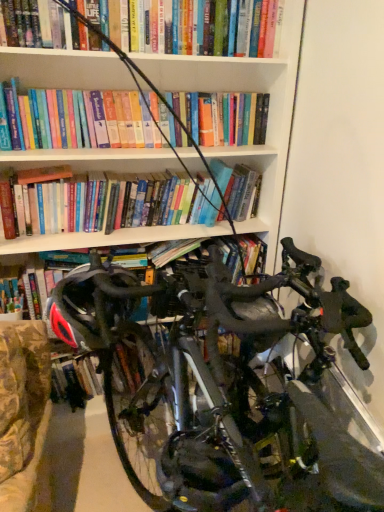
Measure the distance between shiny black bicycle at center and camera.

shiny black bicycle at center and camera are 22.71 inches apart.

I want to click on shiny black bicycle at center, so click(x=223, y=386).

What do you see at coordinates (223, 386) in the screenshot? I see `shiny black bicycle at center` at bounding box center [223, 386].

The height and width of the screenshot is (512, 384). Describe the element at coordinates (82, 306) in the screenshot. I see `black matte helmet at center` at that location.

I want to click on black matte helmet at center, so 82,306.

Locate an element on the screen. shiny black bicycle at center is located at coordinates (223, 386).

Is black matte helmet at center at the right side of shiny black bicycle at center?

No.

Is the depth of black matte helmet at center greater than that of shiny black bicycle at center?

Yes.

Which is nearer, (83,322) or (275,417)?

The point (275,417) is closer.

From the image's perspective, which is below, black matte helmet at center or shiny black bicycle at center?

From the image's view, shiny black bicycle at center is below.

From a real-world perspective, is black matte helmet at center physically located above or below shiny black bicycle at center?

From a real-world perspective, black matte helmet at center is physically above shiny black bicycle at center.

Considering the sizes of black matte helmet at center and shiny black bicycle at center in the image, is black matte helmet at center wider or thinner than shiny black bicycle at center?

In the image, black matte helmet at center appears to be more narrow than shiny black bicycle at center.

Can you confirm if black matte helmet at center is shorter than shiny black bicycle at center?

Yes.

Looking at this image, which of these two, black matte helmet at center or shiny black bicycle at center, is smaller?

black matte helmet at center is smaller.

Is black matte helmet at center positioned beyond the bounds of shiny black bicycle at center?

That's incorrect, black matte helmet at center is not completely outside shiny black bicycle at center.

Is black matte helmet at center not close to shiny black bicycle at center?

That's not correct — black matte helmet at center is a little close to shiny black bicycle at center.

Is shiny black bicycle at center at the back of black matte helmet at center?

Yes, black matte helmet at center is positioned with its back facing shiny black bicycle at center.

What are the coordinates of `helmet above the shiny black bicycle at center (from the image's perspective)` in the screenshot? It's located at (82, 306).

Considering the relative positions of shiny black bicycle at center and black matte helmet at center in the image provided, is shiny black bicycle at center to the right of black matte helmet at center from the viewer's perspective?

Indeed, shiny black bicycle at center is positioned on the right side of black matte helmet at center.

In the image, is shiny black bicycle at center positioned in front of or behind black matte helmet at center?

shiny black bicycle at center is in front of black matte helmet at center.

Is point (325, 298) closer or farther from the camera than point (90, 341)?

Point (325, 298) is closer to the camera than point (90, 341).

From the image's perspective, which object appears higher, shiny black bicycle at center or black matte helmet at center?

black matte helmet at center appears higher in the image.

From a real-world perspective, is shiny black bicycle at center beneath black matte helmet at center?

Yes.

Does shiny black bicycle at center have a lesser width compared to black matte helmet at center?

No, shiny black bicycle at center is not thinner than black matte helmet at center.

Between shiny black bicycle at center and black matte helmet at center, which one has more height?

With more height is shiny black bicycle at center.

From the picture: Between shiny black bicycle at center and black matte helmet at center, which one has smaller size?

black matte helmet at center is smaller.

Is shiny black bicycle at center positioned beyond the bounds of black matte helmet at center?

Absolutely, shiny black bicycle at center is external to black matte helmet at center.

Are shiny black bicycle at center and black matte helmet at center located far from each other?

No, shiny black bicycle at center is not far away from black matte helmet at center.

Is shiny black bicycle at center looking in the opposite direction of black matte helmet at center?

No, shiny black bicycle at center is not facing away from black matte helmet at center.

Can you tell me how much shiny black bicycle at center and black matte helmet at center differ in facing direction?

0.0013 degrees separate the facing orientations of shiny black bicycle at center and black matte helmet at center.

Find the location of a particular element. bicycle below the black matte helmet at center (from a real-world perspective) is located at coordinates (223, 386).

This screenshot has height=512, width=384. Find the location of `helmet on the left of shiny black bicycle at center`. helmet on the left of shiny black bicycle at center is located at coordinates (82, 306).

The height and width of the screenshot is (512, 384). I want to click on bicycle in front of the black matte helmet at center, so click(223, 386).